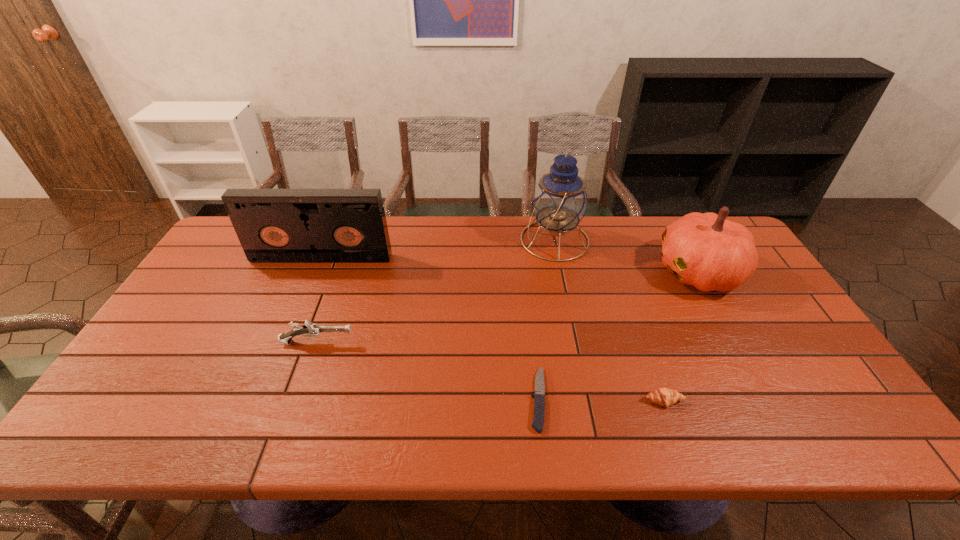
Locate an element on the screen. The image size is (960, 540). pumpkin that is positioned at the far edge is located at coordinates (705, 250).

I want to click on pastry located in the near edge section of the desktop, so click(x=666, y=397).

I want to click on steak knife that is at the near edge, so click(x=539, y=397).

You are a GUI agent. You are given a task and a screenshot of the screen. Output one action in this format:
    pyautogui.click(x=<x>, y=<y>)
    Task: Click on the object present at the left edge
    Image resolution: width=960 pixels, height=540 pixels.
    Given the screenshot: What is the action you would take?
    pyautogui.click(x=273, y=225)

The image size is (960, 540). I want to click on object at the right edge, so click(x=705, y=250).

Identify the location of object present at the far left corner. (273, 225).

You are a GUI agent. You are given a task and a screenshot of the screen. Output one action in this format:
    pyautogui.click(x=<x>, y=<y>)
    Task: Click on the object that is at the far right corner
    The height and width of the screenshot is (540, 960).
    Given the screenshot: What is the action you would take?
    pyautogui.click(x=705, y=250)

In the image, there is a desktop. Where is `vacant region at the far edge`? The image size is (960, 540). vacant region at the far edge is located at coordinates (424, 245).

In the image, there is a desktop. Where is `blank space at the near edge`? The image size is (960, 540). blank space at the near edge is located at coordinates (495, 431).

Locate an element on the screen. Image resolution: width=960 pixels, height=540 pixels. free space at the far left corner is located at coordinates (231, 244).